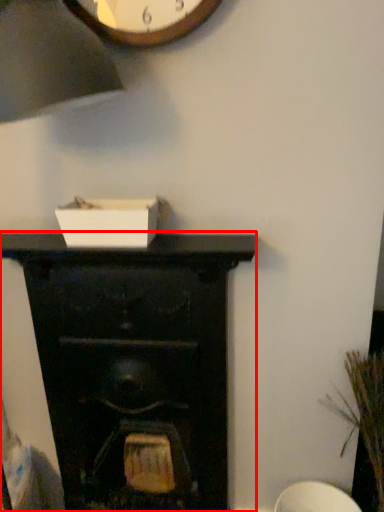
Question: From the image's perspective, where is fireplace (annotated by the red box) located in relation to plant in the image?

Choices:
 (A) below
 (B) above

Answer: (B)